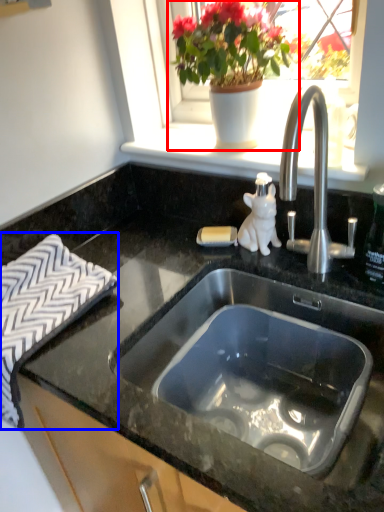
Question: Which object appears farthest to the camera in this image, houseplant (highlighted by a red box) or bath towel (highlighted by a blue box)?

Choices:
 (A) houseplant
 (B) bath towel

Answer: (A)